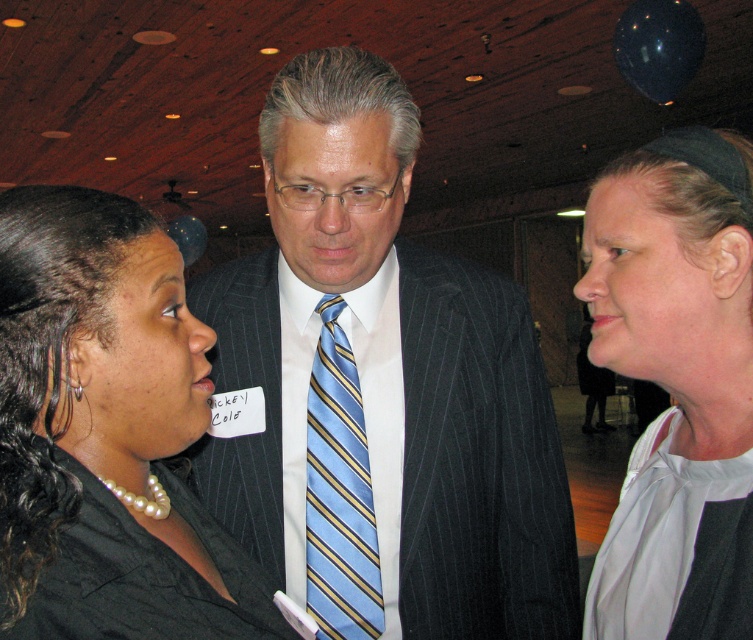
You are a photographer at the event and need to position a spotlight on the dark gray pinstripe suit at center and the black satin blazer at center. Which one should you place the spotlight to the right of?

The dark gray pinstripe suit at center is to the right of the black satin blazer at center, so you should place the spotlight to the right of the dark gray pinstripe suit at center.

Based on the scene description, where is the dark gray pinstripe suit at center located in terms of coordinates?

The dark gray pinstripe suit at center is located at coordinates point [380,388].